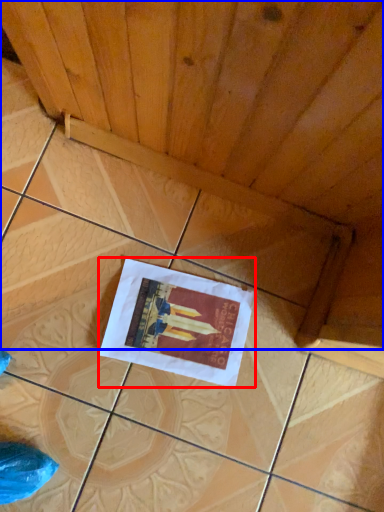
Question: Which of the following is the farthest to the observer, poster (highlighted by a red box) or plywood (highlighted by a blue box)?

Choices:
 (A) poster
 (B) plywood

Answer: (A)